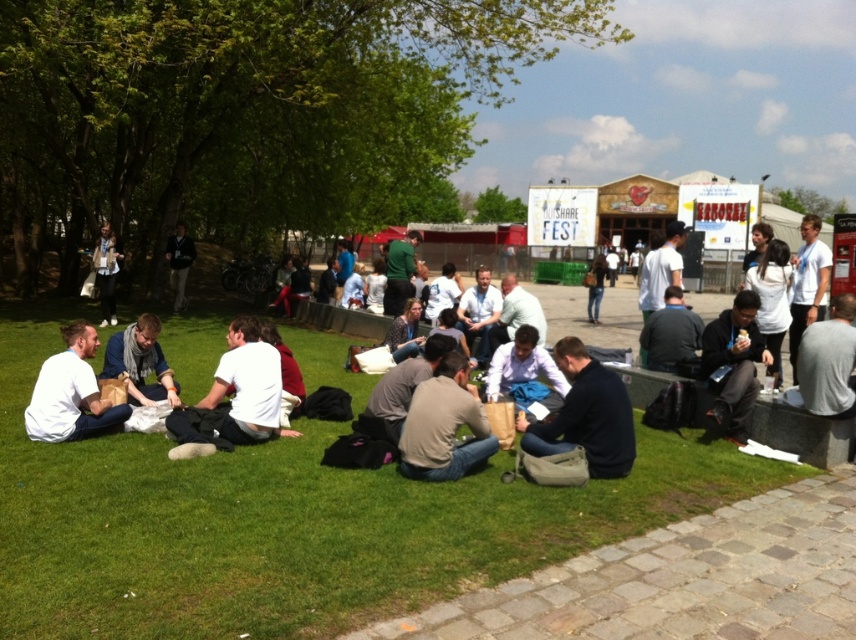
You are at the festival and want to find the gray fabric shirt at lower right. Which direction should you look relative to the dark gray jacket at center?

The gray fabric shirt at lower right is located below the dark gray jacket at center, so you should look downward from the dark gray jacket at center to find it.

Based on the photo, you are organizing a space for a new activity area in the festival. You have to place a small table that requires 2 square feet of space. You see the light brown leather jacket at center and the black fabric jacket at lower right. Which jacket is more likely to fit in the space if you need to temporarily move it?

The light brown leather jacket at center occupies less space than the black fabric jacket at lower right, so it is more likely to fit in the 2 square feet space if moved temporarily.

You are standing in the middle of the festival area and see both the light brown leather jacket at center and the black fabric jacket at lower right. Which jacket is nearer to you?

The light brown leather jacket at center is closer to the viewer than the black fabric jacket at lower right.